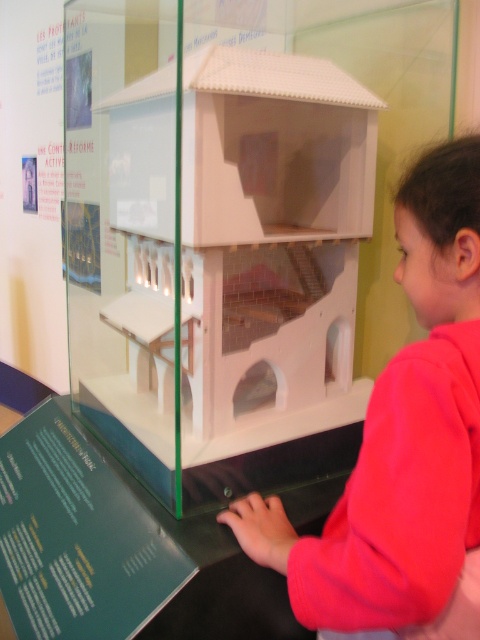
From the picture: Which is more to the right, transparent plastic model house at center or pink fleece jacket at lower right?

pink fleece jacket at lower right

Is transparent plastic model house at center to the right of pink fleece jacket at lower right from the viewer's perspective?

Incorrect, transparent plastic model house at center is not on the right side of pink fleece jacket at lower right.

Identify the location of transparent plastic model house at center. [233, 230].

The height and width of the screenshot is (640, 480). Identify the location of transparent plastic model house at center. (233, 230).